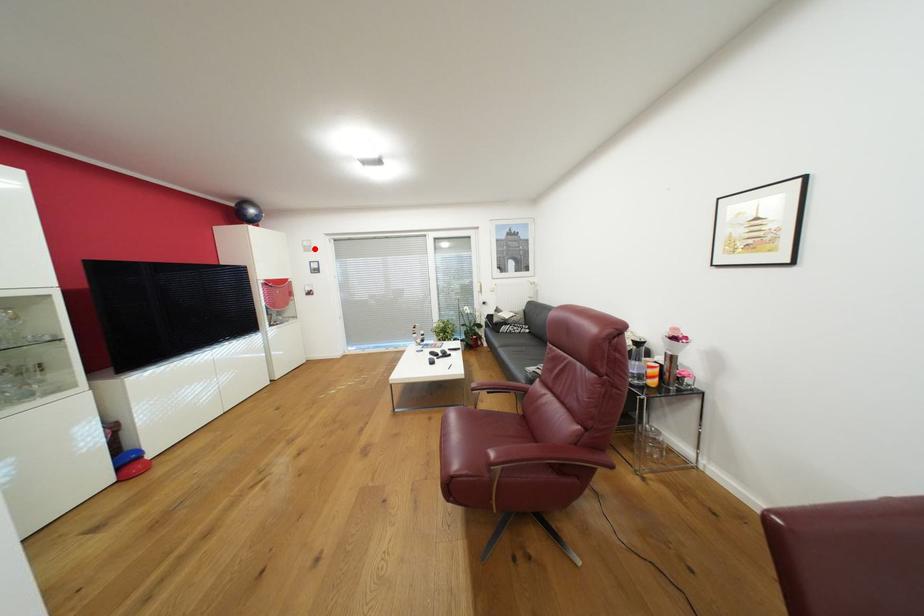
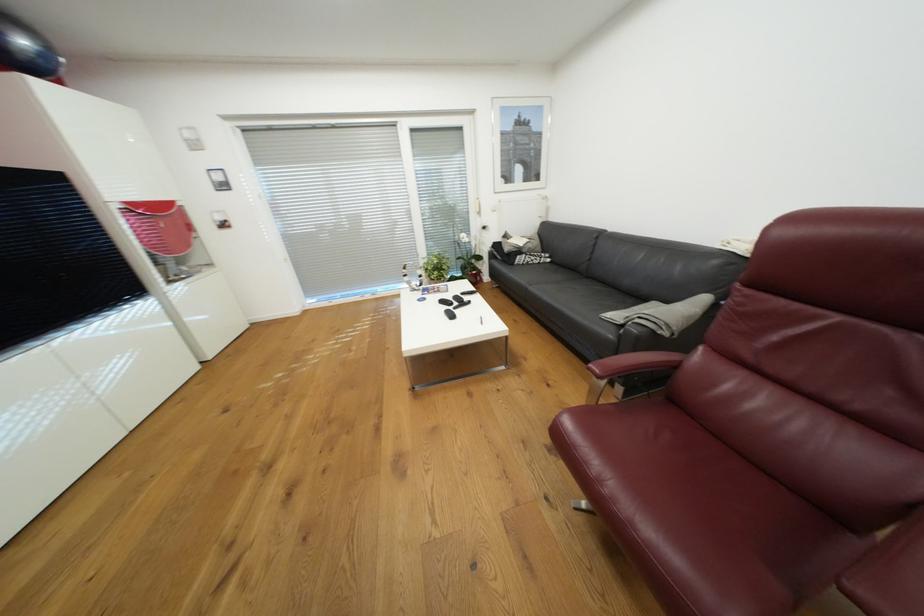
The point at the highlighted location is marked in the first image. Where is the corresponding point in the second image?

(201, 145)